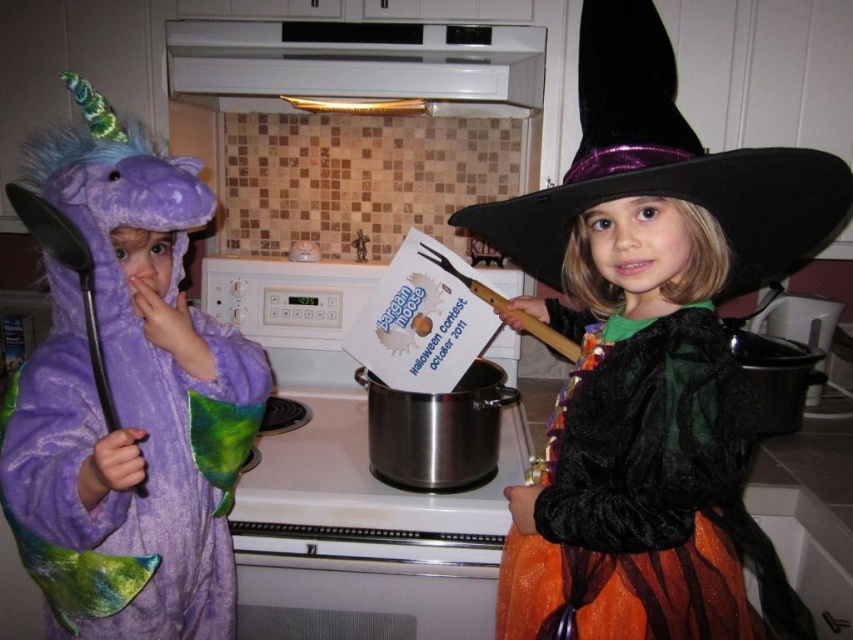
Who is shorter, purple plush unicorn at left or black velvet witch hat at upper right?

Standing shorter between the two is black velvet witch hat at upper right.

Which is in front, point (126, 458) or point (689, 150)?

Positioned in front is point (126, 458).

Is point (202, 392) behind point (722, 164)?

That is True.

Identify the location of purple plush unicorn at left. (128, 403).

Which is above, velvet orange dress at center or black velvet witch hat at upper right?

black velvet witch hat at upper right

Between point (647, 403) and point (556, 188), which one is positioned behind?

Point (647, 403)

Locate an element on the screen. The image size is (853, 640). velvet orange dress at center is located at coordinates (648, 356).

Is velvet orange dress at center closer to the viewer compared to orange tulle dress at right?

Yes, it is in front of orange tulle dress at right.

Is velvet orange dress at center bigger than orange tulle dress at right?

Yes, velvet orange dress at center is bigger than orange tulle dress at right.

Is point (735, 284) positioned before point (688, 417)?

No, (735, 284) is behind (688, 417).

Identify the location of velvet orange dress at center. (648, 356).